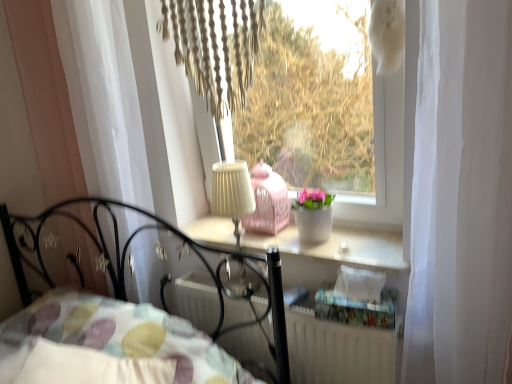
Question: Is patterned fabric pillow at lower left taller or shorter than beige fabric lampshade at center?

Choices:
 (A) short
 (B) tall

Answer: (A)

Question: Looking at their shapes, would you say patterned fabric pillow at lower left is wider or thinner than beige fabric lampshade at center?

Choices:
 (A) thin
 (B) wide

Answer: (B)

Question: Estimate the real-world distances between objects in this image. Which object is farther from the patterned fabric pillow at lower left?

Choices:
 (A) metallic black bed at lower left
 (B) white sheer curtain at left
 (C) white textured radiator at lower center
 (D) white matte window at center
 (E) beige fabric lampshade at center

Answer: (D)

Question: Estimate the real-world distances between objects in this image. Which object is farther from the white sheer curtain at left?

Choices:
 (A) patterned fabric pillow at lower left
 (B) white textured radiator at lower center
 (C) white matte window sill at center
 (D) beige fabric lampshade at center
 (E) white matte window at center

Answer: (E)